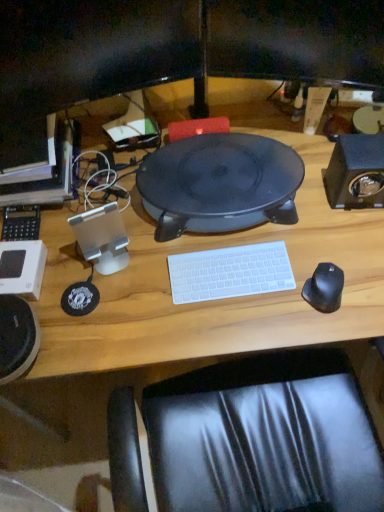
Find the location of a particular element. vacant space in front of black matte speaker at center is located at coordinates (218, 297).